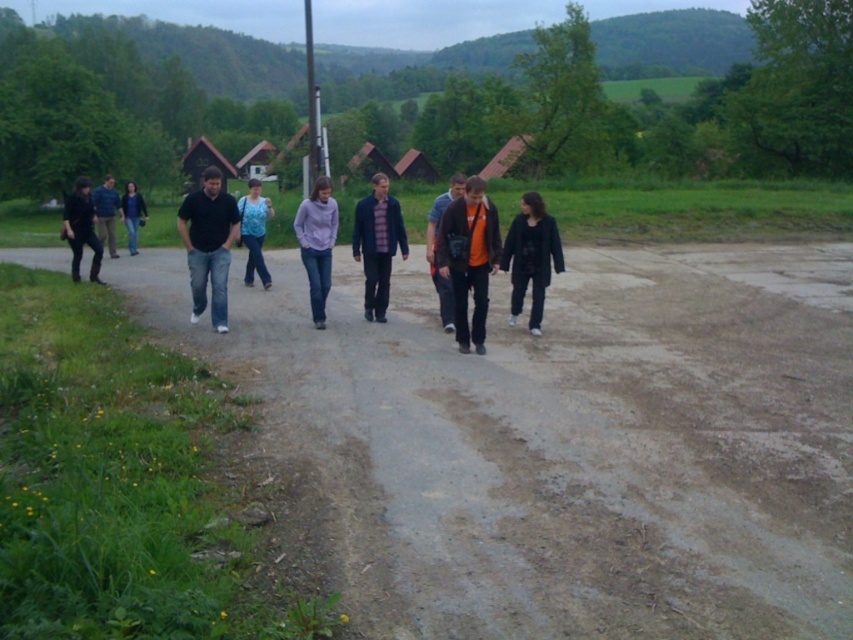
You are part of a group walking along a dirt path and want to take a photo of two people wearing black matte shirt at center and purple matte shirt at center. Which one should you aim the camera towards first to capture both in the frame?

You should aim the camera towards the black matte shirt at center first since it is to the left of the purple matte shirt at center, allowing both to be captured in the frame from left to right.

You are a photographer trying to capture a photo of the orange fabric jacket at center and the smooth gray pole at center in the same frame. Based on their sizes, which object should you focus on first to ensure both are in focus?

The orange fabric jacket at center has a smaller size compared to the smooth gray pole at center. To ensure both are in focus, you should focus on the orange fabric jacket at center first since it is closer to the camera, allowing the gray pole to fall within the depth of field.